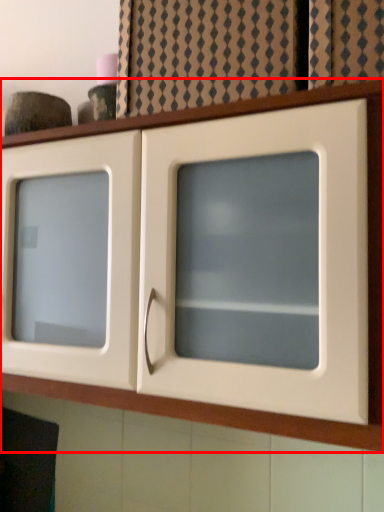
Question: From the image, what is the correct spatial relationship of cupboard (annotated by the red box) in relation to curtain?

Choices:
 (A) right
 (B) left

Answer: (B)